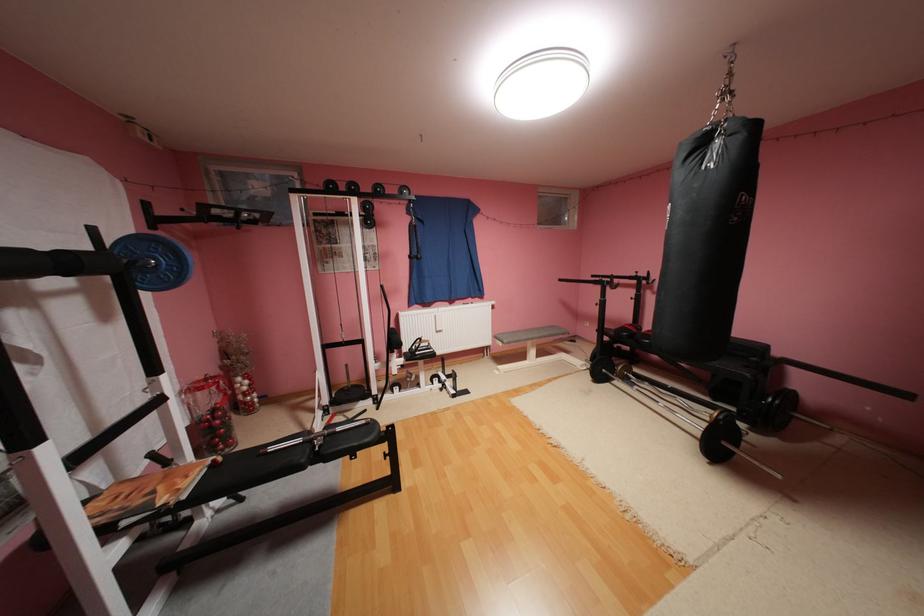
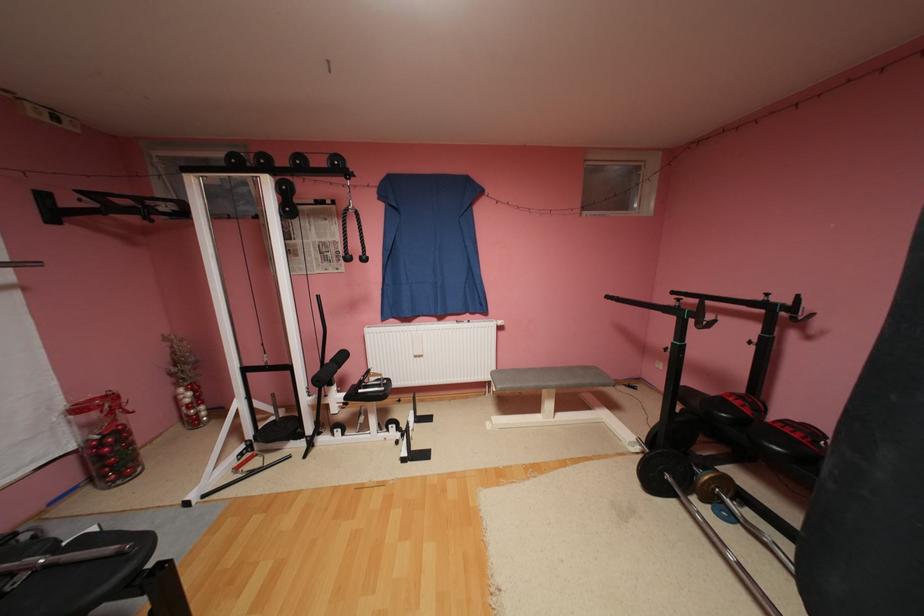
Which direction would the cameraman need to move to produce the second image?

The movement direction of the cameraman is right, forward.